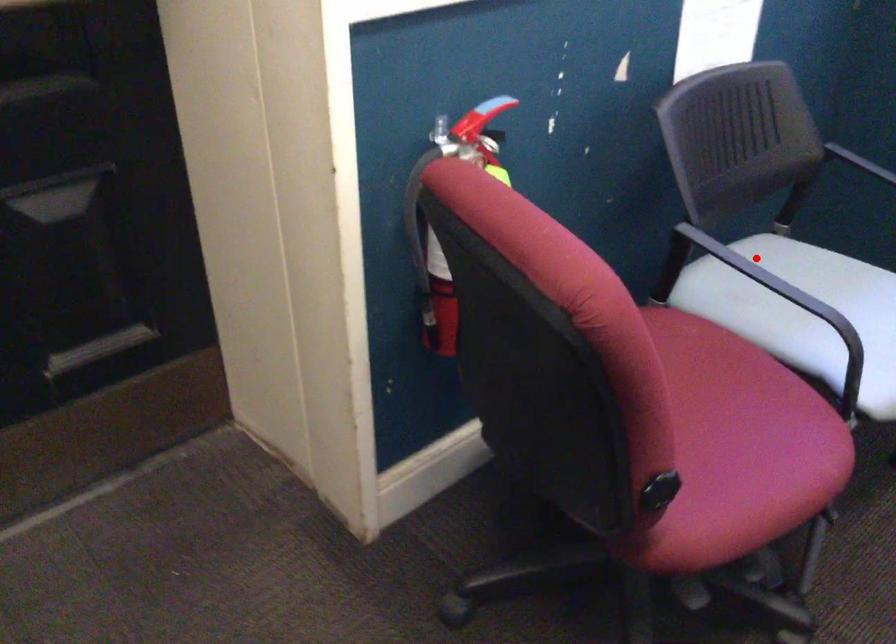
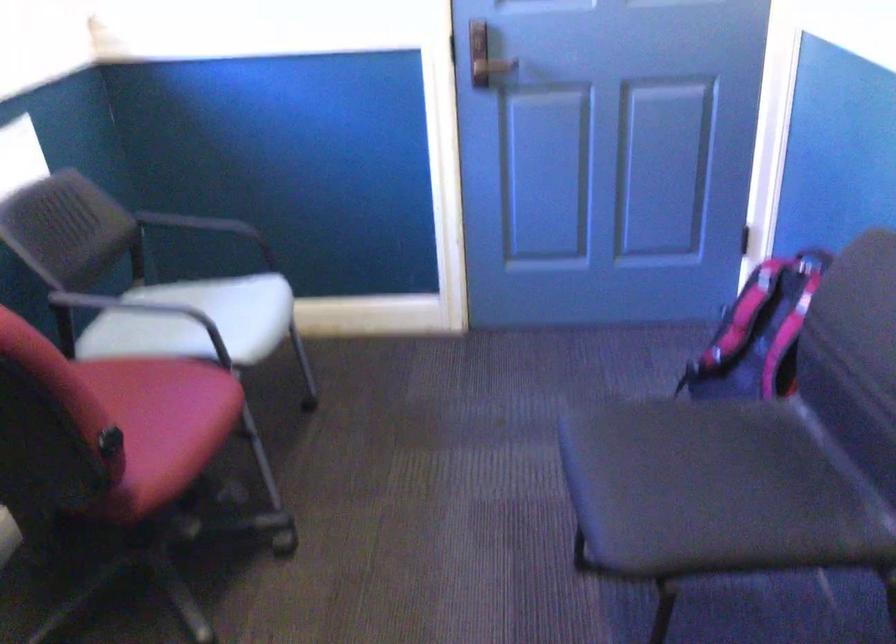
Question: I am providing you with two images of the same scene from different viewpoints. Image1 has a red point marked. In image2, the corresponding 3D location appears at what relative position? Reply with the corresponding letter.

Choices:
 (A) Closer
 (B) Farther

Answer: (B)